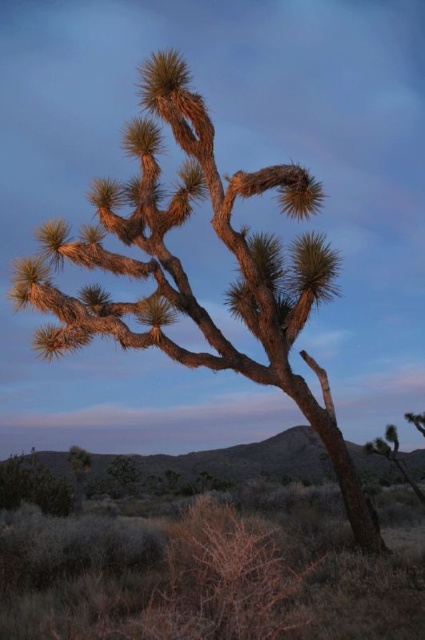
Which is behind, point (101, 296) or point (82, 470)?

The point (82, 470) is behind.

Is point (56, 349) positioned behind point (78, 492)?

No, (56, 349) is in front of (78, 492).

The width and height of the screenshot is (425, 640). I want to click on brown rough bark tree at center, so click(186, 275).

Does brown rough bark tree at lower right appear on the right side of brown rough bark tree at lower left?

Yes, brown rough bark tree at lower right is to the right of brown rough bark tree at lower left.

Is brown rough bark tree at lower right thinner than brown rough bark tree at lower left?

Incorrect, brown rough bark tree at lower right's width is not less than brown rough bark tree at lower left's.

Does point (384, 438) lie in front of point (70, 458)?

Yes.

Where is `brown rough bark tree at lower right`? Image resolution: width=425 pixels, height=640 pixels. brown rough bark tree at lower right is located at coordinates (393, 456).

Is the position of brown rough bark tree at center less distant than that of brown rough bark tree at lower right?

Yes, it is in front of brown rough bark tree at lower right.

Is brown rough bark tree at center to the left of brown rough bark tree at lower right from the viewer's perspective?

Indeed, brown rough bark tree at center is positioned on the left side of brown rough bark tree at lower right.

Identify the location of brown rough bark tree at center. This screenshot has width=425, height=640. (186, 275).

This screenshot has height=640, width=425. What are the coordinates of `brown rough bark tree at center` in the screenshot? It's located at (186, 275).